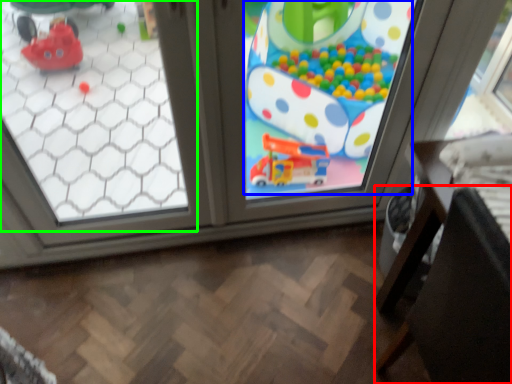
Question: Which is nearer to the chair (highlighted by a red box)? toy (highlighted by a blue box) or window (highlighted by a green box).

Choices:
 (A) toy
 (B) window

Answer: (A)